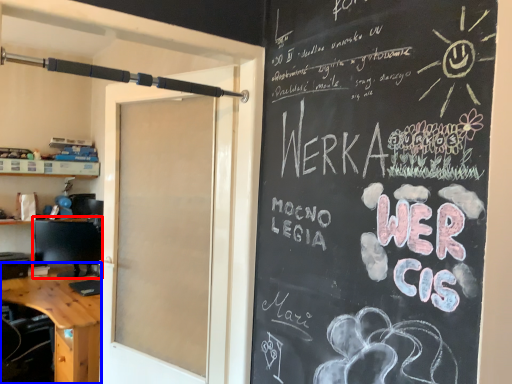
Question: Which point is closer to the camera, computer monitor (highlighted by a red box) or desk (highlighted by a blue box)?

Choices:
 (A) computer monitor
 (B) desk

Answer: (B)